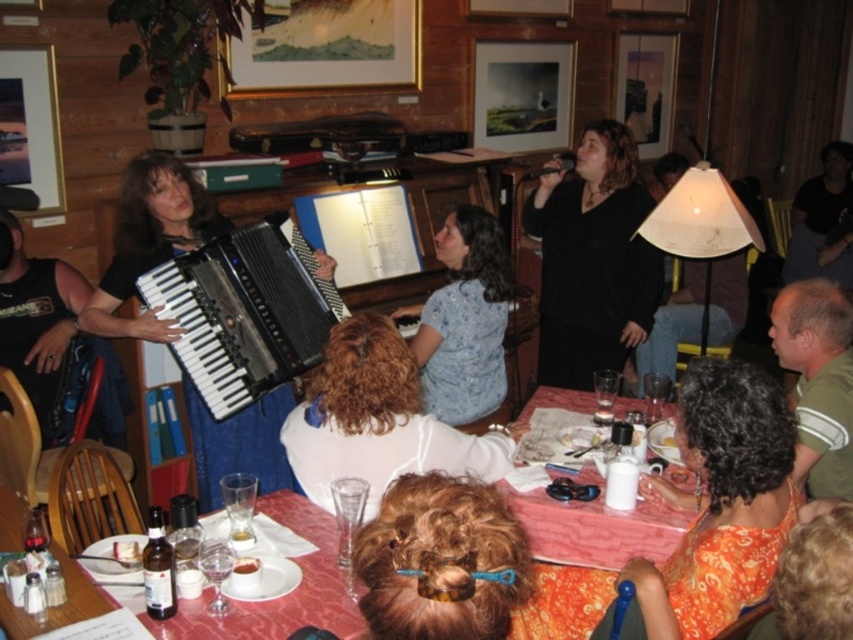
Question: Is blue floral shirt at center in front of marble table at center?

Choices:
 (A) no
 (B) yes

Answer: (A)

Question: Which point is closer to the camera?

Choices:
 (A) (199, 637)
 (B) (422, 387)
 (C) (149, 305)
 (D) (645, 243)

Answer: (A)

Question: Does black matte dress at upper center have a greater width compared to white fabric lampshade at upper right?

Choices:
 (A) no
 (B) yes

Answer: (A)

Question: Estimate the real-world distances between objects in this image. Which object is farther from the brown curly hair at center?

Choices:
 (A) orange fabric dress at lower right
 (B) blue floral shirt at center
 (C) white fabric lampshade at upper right
 (D) black matte accordion at left

Answer: (C)

Question: Which point is farther to the camera?

Choices:
 (A) (575, 513)
 (B) (395, 636)
 (C) (236, 563)
 (D) (479, 300)

Answer: (D)

Question: In this image, where is black matte dress at upper center located relative to black matte accordion at left?

Choices:
 (A) below
 (B) above

Answer: (B)